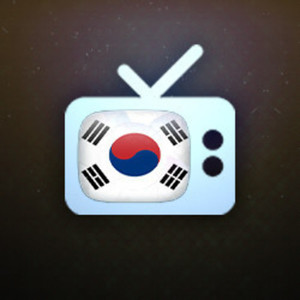
At what (x,y) coordinates should I click in order to perform the action: click on tv. Please return your answer as a coordinate pair (x, y). The height and width of the screenshot is (300, 300). Looking at the image, I should click on (127, 201).